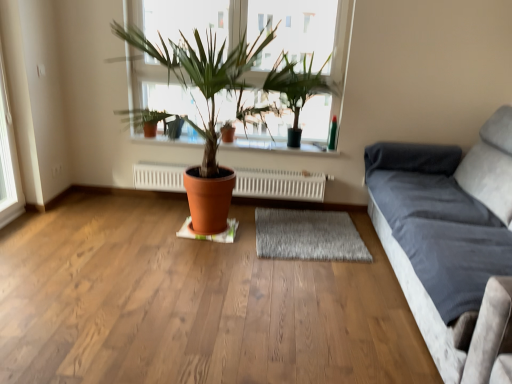
Locate an element on the screen. This screenshot has width=512, height=384. vacant area in front of white plastic window frame at left is located at coordinates (13, 235).